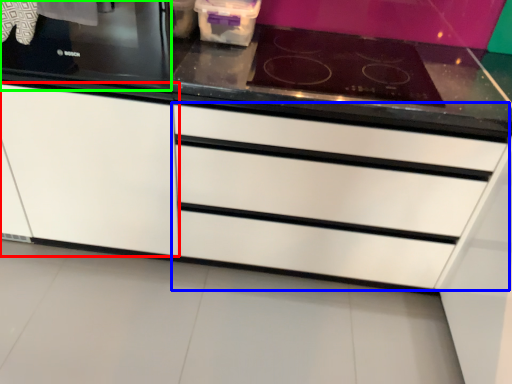
Question: Considering the real-world distances, which object is farthest from cabinetry (highlighted by a red box)? drawer (highlighted by a blue box) or home appliance (highlighted by a green box)?

Choices:
 (A) drawer
 (B) home appliance

Answer: (A)